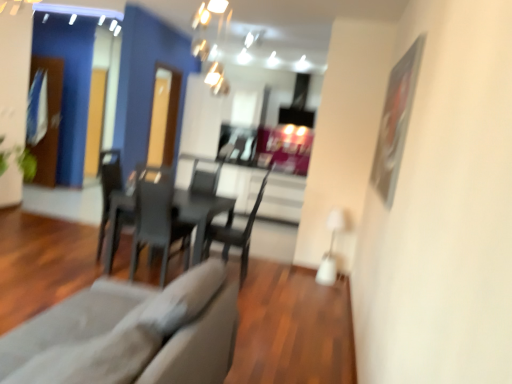
Question: From the image's perspective, is matte black table at center located above or below matte black chair at center, the second armchair positioned from the left?

Choices:
 (A) below
 (B) above

Answer: (A)

Question: Looking at their shapes, would you say matte black table at center is wider or thinner than matte black chair at center, the 1th armchair in the right-to-left sequence?

Choices:
 (A) thin
 (B) wide

Answer: (B)

Question: Based on their relative distances, which object is farther from the matte gray armchair at center, arranged as the first armchair when viewed from the left?

Choices:
 (A) gray fabric couch at lower left
 (B) matte black chair at center, arranged as the 1th chair when viewed from the right
 (C) transparent glass door at left, the second glass door positioned from the front
 (D) black plastic chair at center, the first chair viewed from the left
 (E) matte black table at center

Answer: (C)

Question: Which object is the farthest from the gray fabric couch at lower left?

Choices:
 (A) matte black chair at center, arranged as the 2th chair when viewed from the left
 (B) matte black chair at center, the second armchair positioned from the left
 (C) transparent glass door at left, the second glass door positioned from the front
 (D) transparent glass door at center, arranged as the 1th glass door when viewed from the front
 (E) metallic silver picture frame at upper right

Answer: (C)